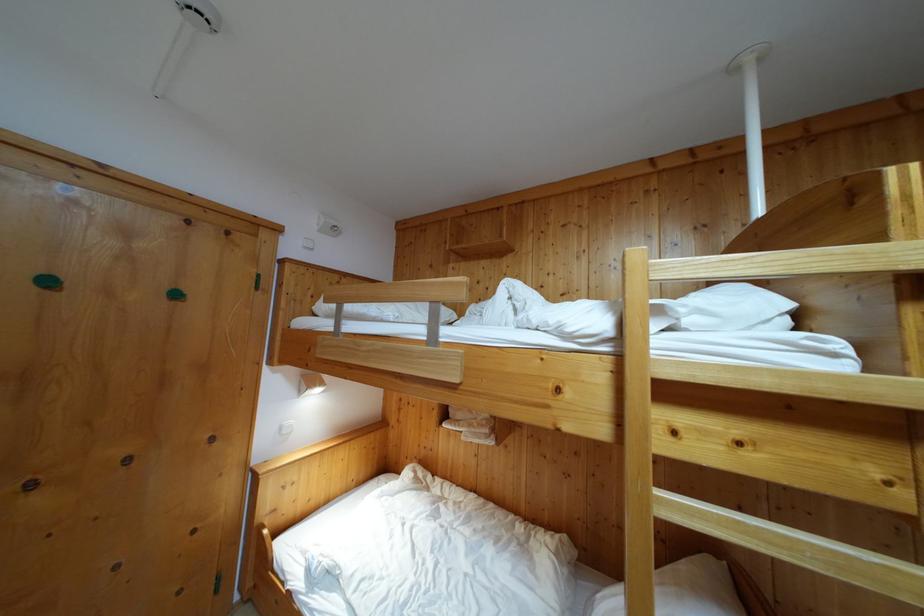
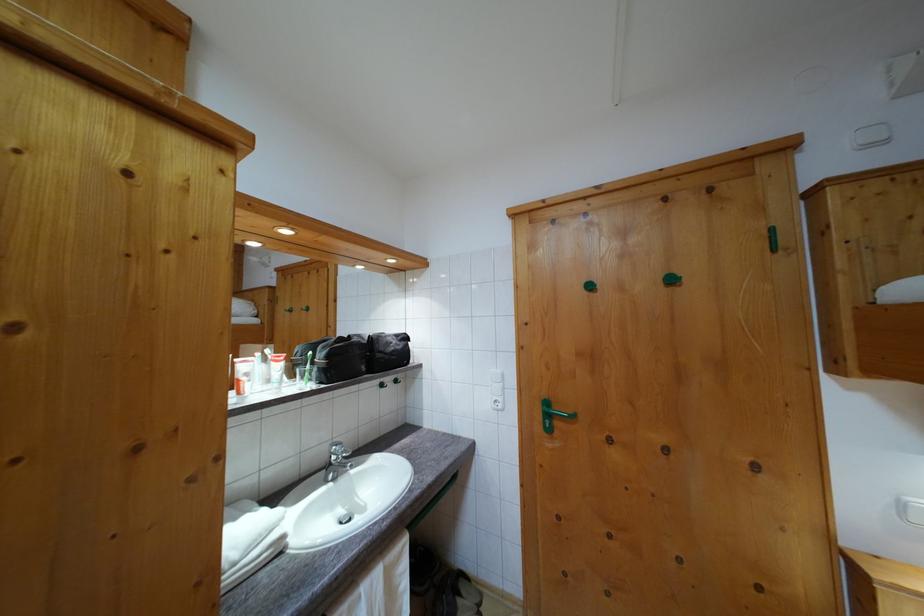
Question: The camera is either moving clockwise (left) or counter-clockwise (right) around the object. The first image is from the beginning of the video and the second image is from the end. Is the camera moving left or right when shooting the video?

Choices:
 (A) Left
 (B) Right

Answer: (B)